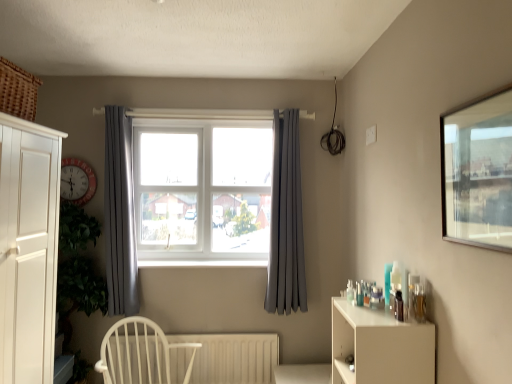
Question: Relative to white wood chair at lower left, is matte red clock at left in front or behind?

Choices:
 (A) front
 (B) behind

Answer: (B)

Question: From the image's perspective, is matte red clock at left positioned above or below white wood chair at lower left?

Choices:
 (A) below
 (B) above

Answer: (B)

Question: Estimate the real-world distances between objects in this image. Which object is farther from the white plastic window at center?

Choices:
 (A) gray fabric curtain at left, positioned as the first curtain in left-to-right order
 (B) white matte shelf at right
 (C) transparent glass window at upper right
 (D) satin grey curtain at center, the 2th curtain positioned from the left
 (E) matte red clock at left

Answer: (C)

Question: Which of these objects is positioned farthest from the white plastic radiator at lower center?

Choices:
 (A) white wood chair at lower left
 (B) gray fabric curtain at left, placed as the second curtain when sorted from right to left
 (C) satin grey curtain at center, which appears as the 1th curtain when viewed from the right
 (D) transparent glass window at upper right
 (E) matte red clock at left

Answer: (D)